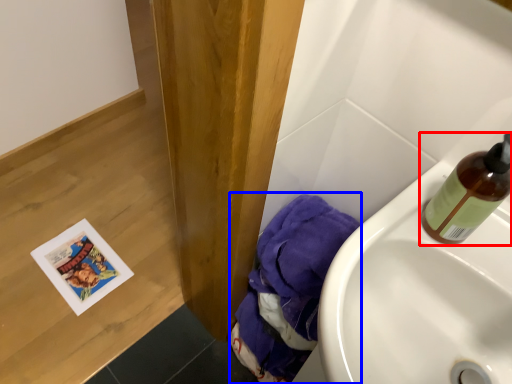
Question: Which object is further to the camera taking this photo, bottle (highlighted by a red box) or material (highlighted by a blue box)?

Choices:
 (A) bottle
 (B) material

Answer: (B)